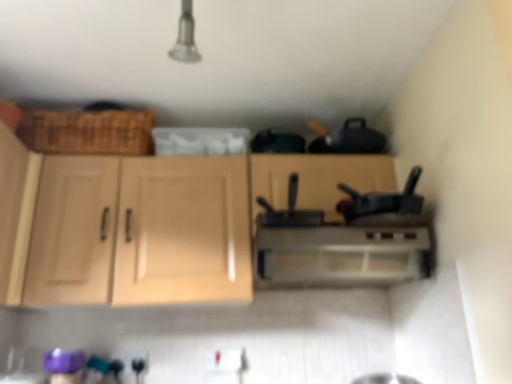
Question: From their relative heights in the image, would you say black matte pan at center is taller or shorter than satin silver range hood at center?

Choices:
 (A) tall
 (B) short

Answer: (B)

Question: Is black matte pan at center wider or thinner than satin silver range hood at center?

Choices:
 (A) wide
 (B) thin

Answer: (B)

Question: Based on their relative distances, which object is farther from the light wood cabinet at center, positioned as the 2th cabinetry in left-to-right order?

Choices:
 (A) light wood cabinet at left, the 1th cabinetry from the left
 (B) satin silver range hood at center
 (C) black matte pan at center

Answer: (B)

Question: Which object is positioned closest to the light wood cabinet at center, positioned as the 2th cabinetry in left-to-right order?

Choices:
 (A) light wood cabinet at left, which is the 2th cabinetry in right-to-left order
 (B) black matte pan at center
 (C) satin silver range hood at center

Answer: (A)